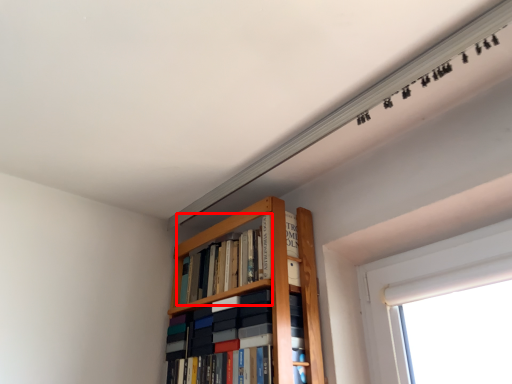
Question: Considering the relative positions of book (annotated by the red box) and book in the image provided, where is book (annotated by the red box) located with respect to the staircase?

Choices:
 (A) left
 (B) right

Answer: (B)